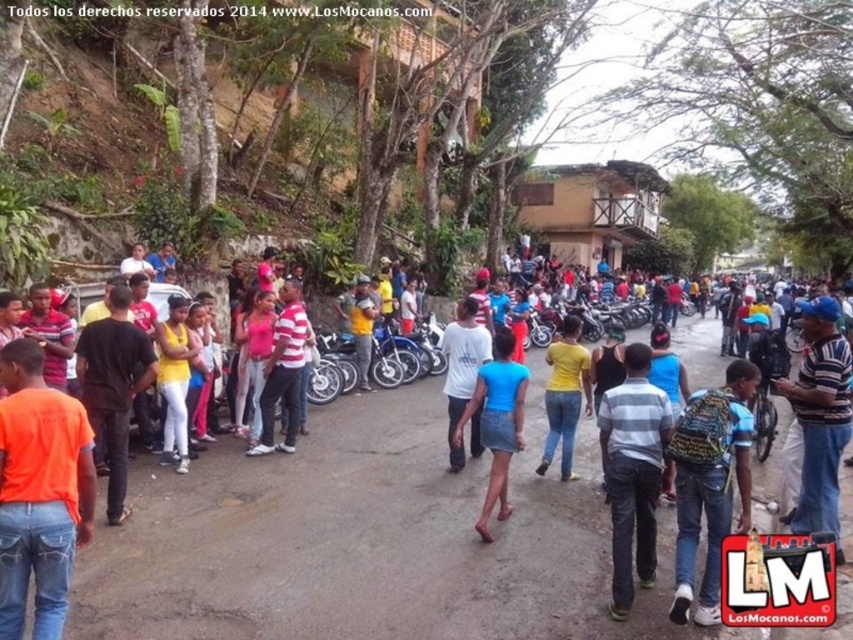
Question: From the image, what is the correct spatial relationship of matte black shirt at center in relation to striped cotton shirt at center-right?

Choices:
 (A) below
 (B) above

Answer: (A)

Question: Is black matte shirt at center below yellow matte shirt at center?

Choices:
 (A) yes
 (B) no

Answer: (B)

Question: Which object appears closest to the camera in this image?

Choices:
 (A) yellow backpack at center
 (B) matte black shirt at center

Answer: (B)

Question: Which object is the farthest from the white cotton shirt at center?

Choices:
 (A) matte black shirt at center
 (B) matte pink shirt at center

Answer: (B)

Question: Is orange matte shirt at lower left wider than striped cotton shirt at center-right?

Choices:
 (A) no
 (B) yes

Answer: (A)

Question: Which of the following is the closest to the observer?

Choices:
 (A) (518, 362)
 (B) (814, 432)
 (C) (473, 442)

Answer: (B)